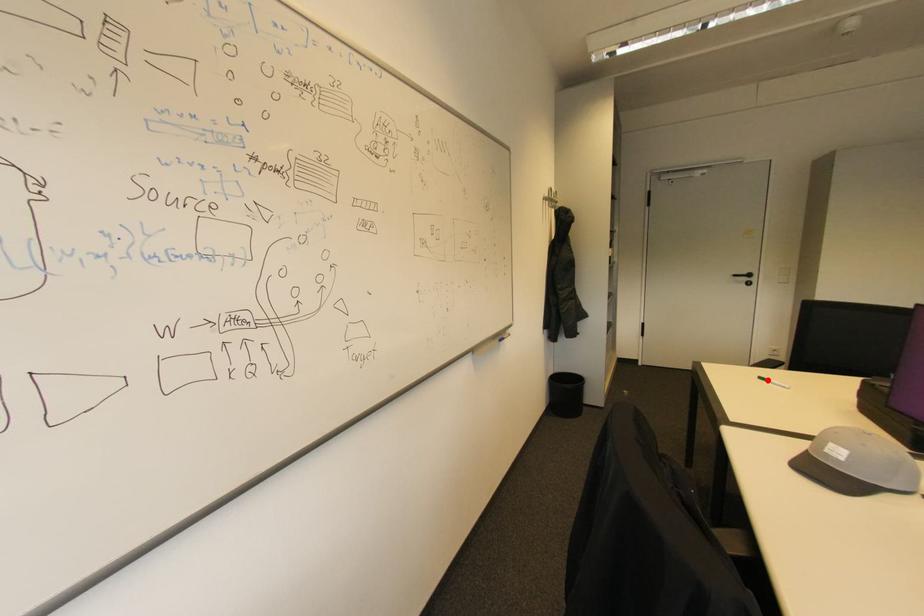
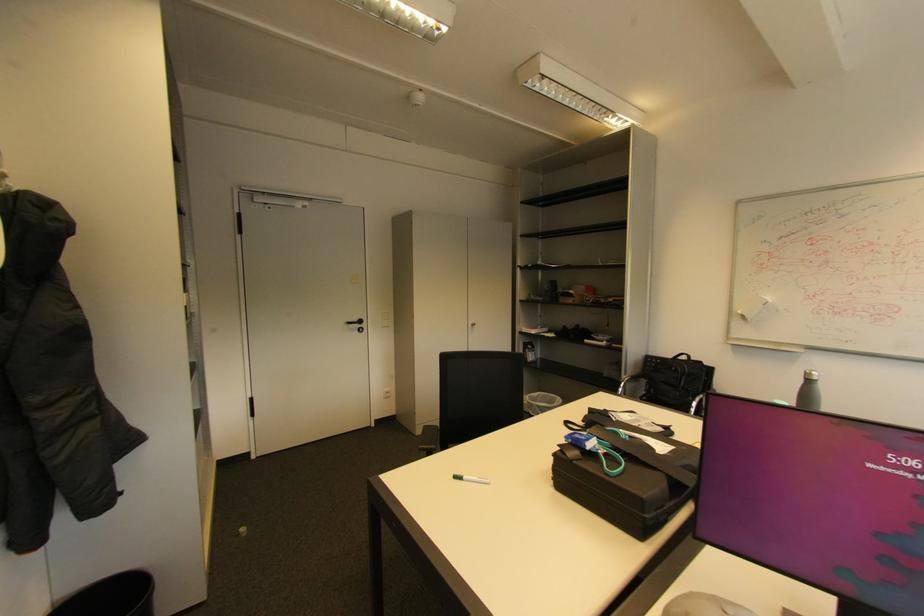
Find the pixel in the second image that matches the highlighted location in the first image.

(460, 477)